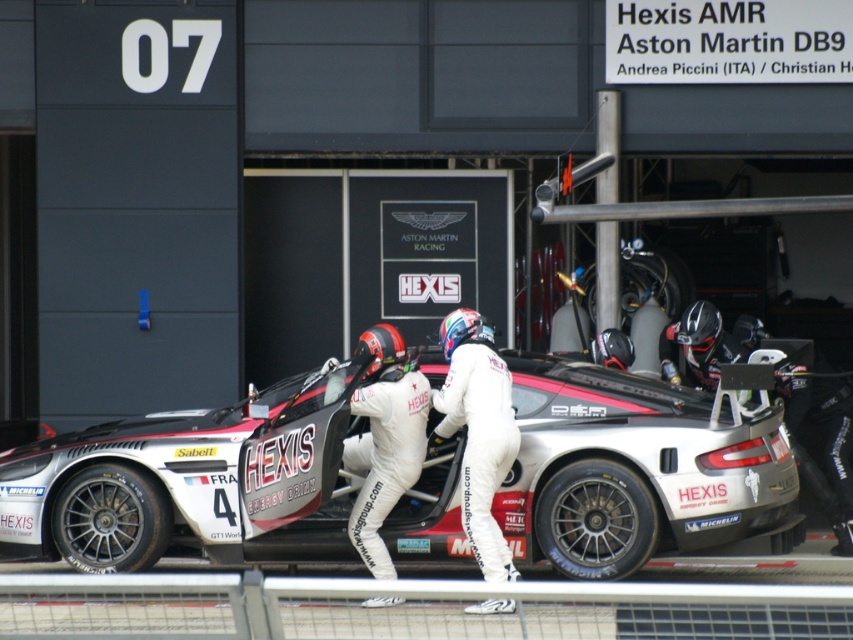
Can you confirm if white matte sports car at center is positioned to the right of white smooth suit at center?

Incorrect, white matte sports car at center is not on the right side of white smooth suit at center.

Which is in front, point (244, 544) or point (512, 451)?

Positioned in front is point (512, 451).

Locate an element on the screen. white matte sports car at center is located at coordinates (635, 470).